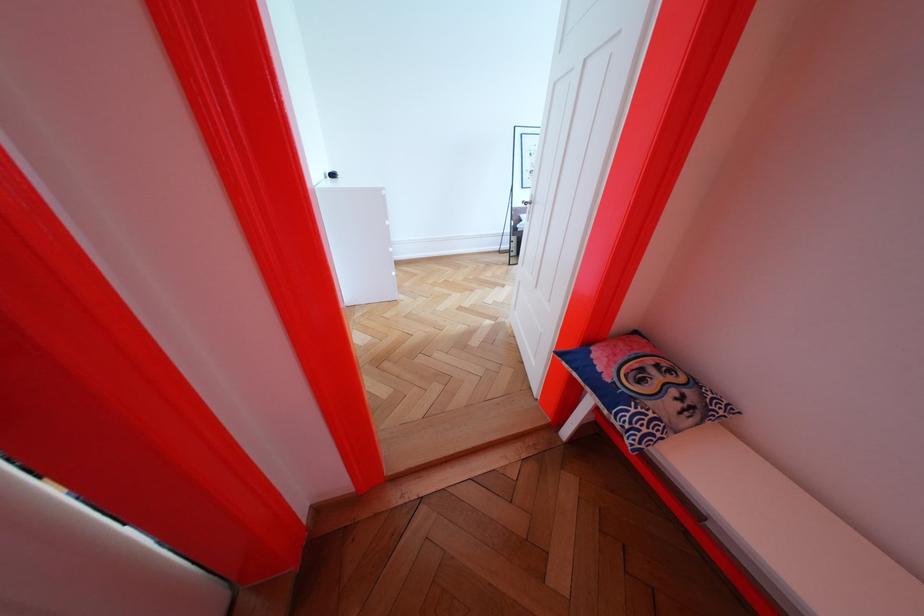
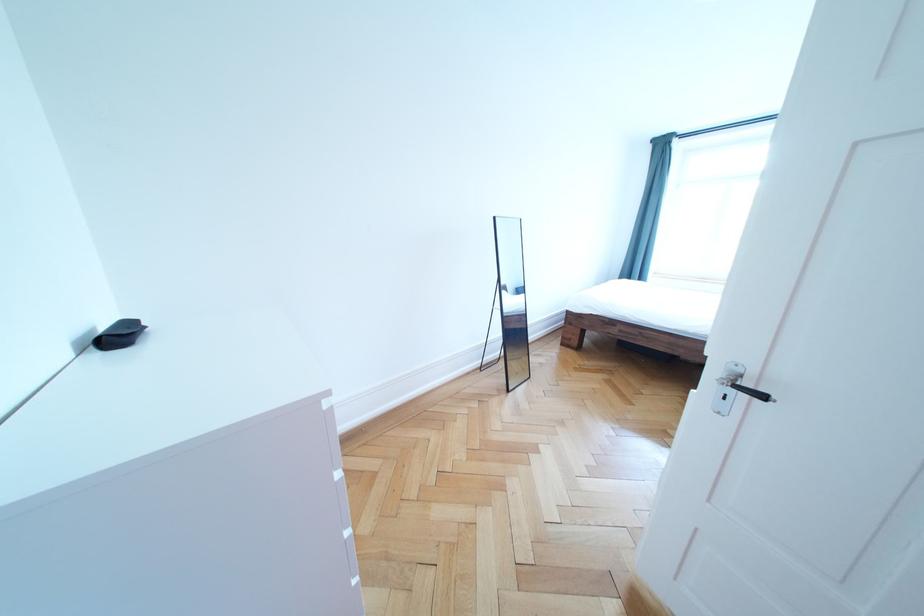
Locate, in the second image, the point that corresponds to point (343, 180) in the first image.

(128, 344)